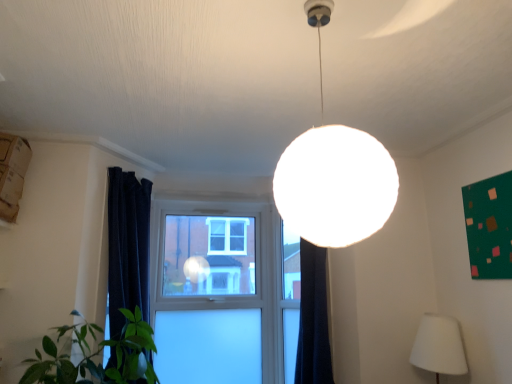
Question: From a real-world perspective, is clear glass window at center on green matte bulletin board at upper right?

Choices:
 (A) no
 (B) yes

Answer: (A)

Question: Is clear glass window at center facing towards green matte bulletin board at upper right?

Choices:
 (A) yes
 (B) no

Answer: (B)

Question: Considering the relative sizes of clear glass window at center and green matte bulletin board at upper right in the image provided, is clear glass window at center bigger than green matte bulletin board at upper right?

Choices:
 (A) yes
 (B) no

Answer: (A)

Question: Considering the relative positions of clear glass window at center and green matte bulletin board at upper right in the image provided, is clear glass window at center in front of green matte bulletin board at upper right?

Choices:
 (A) no
 (B) yes

Answer: (A)

Question: Is clear glass window at center far away from green matte bulletin board at upper right?

Choices:
 (A) no
 (B) yes

Answer: (B)

Question: From the image's perspective, is white matte sphere at center, the first lamp positioned from the left, above or below green matte bulletin board at upper right?

Choices:
 (A) above
 (B) below

Answer: (A)

Question: Considering the positions of white matte sphere at center, positioned as the first lamp in front-to-back order, and green matte bulletin board at upper right in the image, is white matte sphere at center, positioned as the first lamp in front-to-back order, wider or thinner than green matte bulletin board at upper right?

Choices:
 (A) wide
 (B) thin

Answer: (A)

Question: Visually, is white matte sphere at center, the first lamp positioned from the left, positioned to the left or to the right of green matte bulletin board at upper right?

Choices:
 (A) left
 (B) right

Answer: (A)

Question: Which is correct: white matte sphere at center, positioned as the first lamp in front-to-back order, is inside green matte bulletin board at upper right, or outside of it?

Choices:
 (A) outside
 (B) inside

Answer: (A)

Question: In terms of size, does green matte bulletin board at upper right appear bigger or smaller than clear glass window at center?

Choices:
 (A) small
 (B) big

Answer: (A)

Question: Does point (465, 230) appear closer or farther from the camera than point (172, 347)?

Choices:
 (A) closer
 (B) farther

Answer: (A)

Question: From the image's perspective, is green matte bulletin board at upper right positioned above or below clear glass window at center?

Choices:
 (A) below
 (B) above

Answer: (B)

Question: Visually, is green matte bulletin board at upper right positioned to the left or to the right of clear glass window at center?

Choices:
 (A) right
 (B) left

Answer: (A)

Question: Which is correct: white fabric lampshade at lower right, the 1th lamp viewed from the back, is inside green matte bulletin board at upper right, or outside of it?

Choices:
 (A) inside
 (B) outside

Answer: (B)

Question: Would you say white fabric lampshade at lower right, the 1th lamp when ordered from right to left, is to the left or to the right of green matte bulletin board at upper right in the picture?

Choices:
 (A) left
 (B) right

Answer: (A)